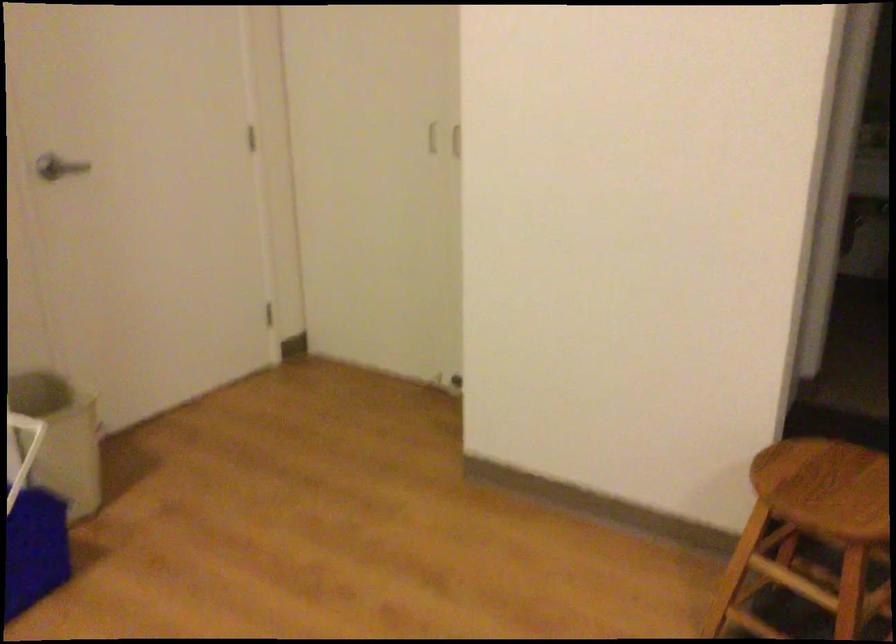
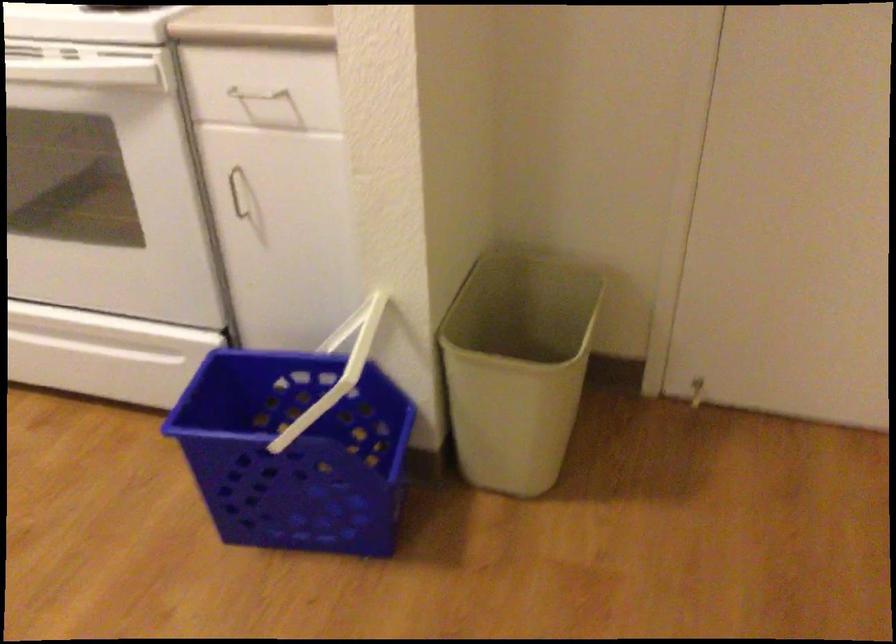
Locate, in the second image, the point that corresponds to the point at 79,410 in the first image.

(517, 366)